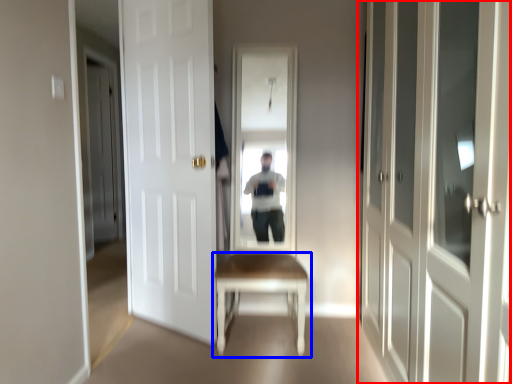
Question: Among these objects, which one is nearest to the camera, door (highlighted by a red box) or table (highlighted by a blue box)?

Choices:
 (A) door
 (B) table

Answer: (A)